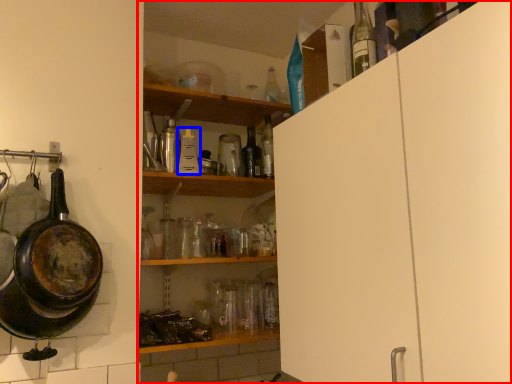
Question: Which of the following is the closest to the observer, shelf (highlighted by a red box) or bottle (highlighted by a blue box)?

Choices:
 (A) shelf
 (B) bottle

Answer: (A)